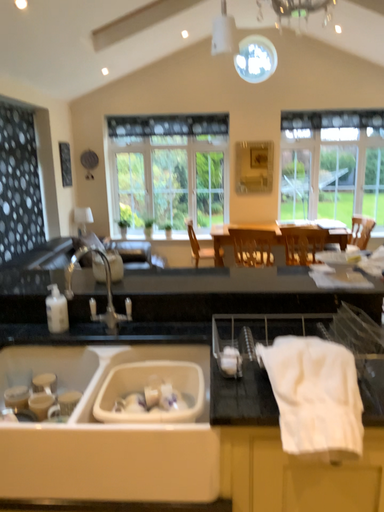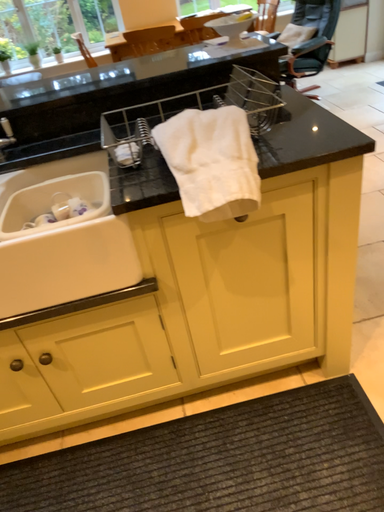
Question: Which way did the camera rotate in the video?

Choices:
 (A) rotated right
 (B) rotated left

Answer: (A)